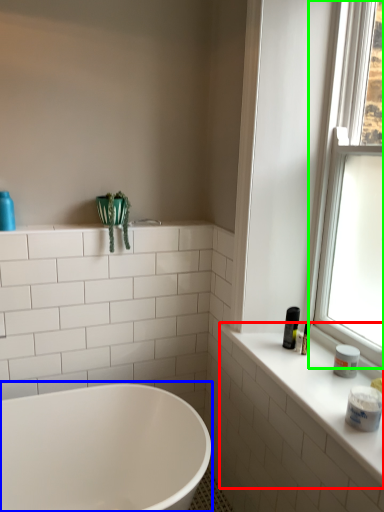
Question: Which object is the closest to the counter top (highlighted by a red box)? Choose among these: bathtub (highlighted by a blue box) or window (highlighted by a green box).

Choices:
 (A) bathtub
 (B) window

Answer: (B)